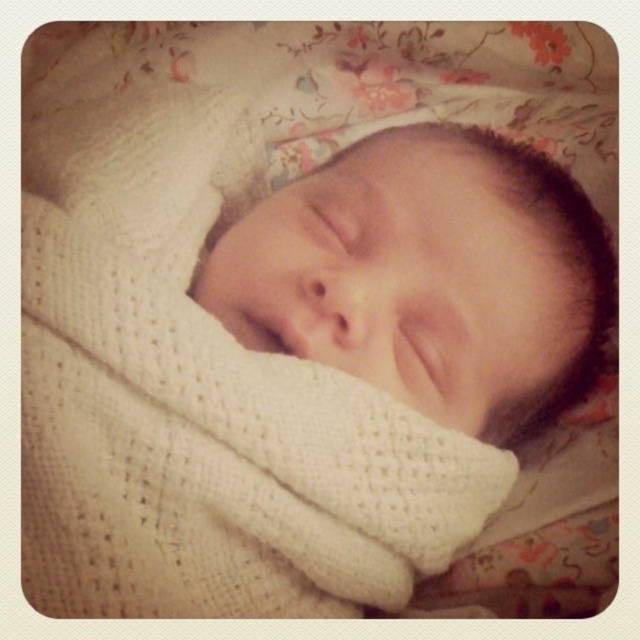
You are holding a 40 cm long toy and want to place it on the spot marked by point (60, 484). Can the toy fit entirely on that spot without hanging off?

The point is 48.11 centimeters away from the viewer, so the 40 cm long toy can fit entirely on that spot since it is shorter than the distance to the point.

You are an AI analyzing the image. The scene shows a sleeping baby. Where is the white knitted blanket at center located in terms of coordinates?

The white knitted blanket at center is located at coordinates point (x=204, y=406).